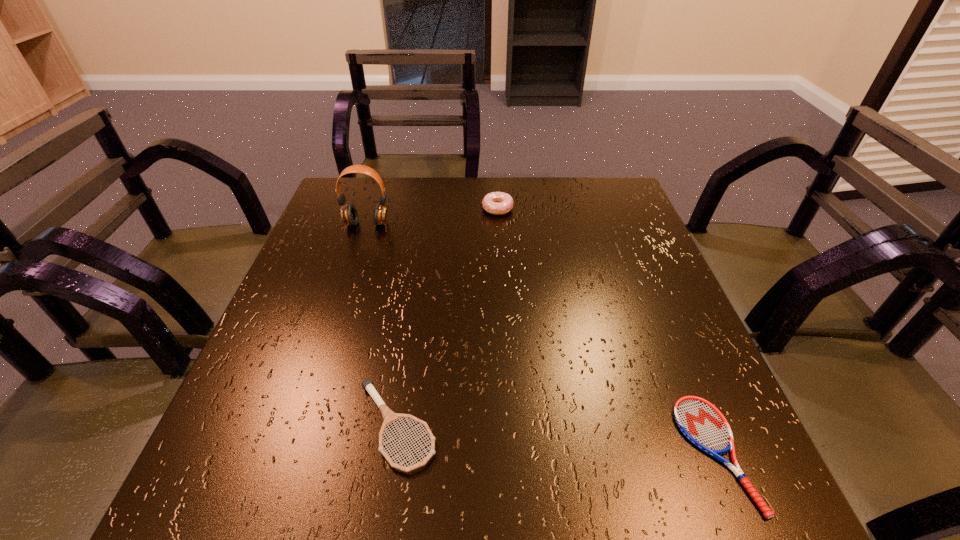
You are a GUI agent. You are given a task and a screenshot of the screen. Output one action in this format:
    pyautogui.click(x=<x>, y=<y>)
    Task: Click on the vacant area situated on the right of the left tennis racket
    The image size is (960, 540).
    Given the screenshot: What is the action you would take?
    pyautogui.click(x=566, y=426)

You are a GUI agent. You are given a task and a screenshot of the screen. Output one action in this format:
    pyautogui.click(x=<x>, y=<y>)
    Task: Click on the vacant region located on the back of the right tennis racket
    
    Given the screenshot: What is the action you would take?
    pyautogui.click(x=676, y=357)

Find the location of a particular element. This screenshot has height=540, width=960. headset located in the far edge section of the desktop is located at coordinates (349, 215).

Locate an element on the screen. The height and width of the screenshot is (540, 960). doughnut present at the far edge is located at coordinates (498, 203).

You are a GUI agent. You are given a task and a screenshot of the screen. Output one action in this format:
    pyautogui.click(x=<x>, y=<y>)
    Task: Click on the object that is at the left edge
    The height and width of the screenshot is (540, 960).
    Given the screenshot: What is the action you would take?
    pyautogui.click(x=349, y=215)

You are a GUI agent. You are given a task and a screenshot of the screen. Output one action in this format:
    pyautogui.click(x=<x>, y=<y>)
    Task: Click on the object present at the right edge
    
    Given the screenshot: What is the action you would take?
    pyautogui.click(x=700, y=421)

At what (x,y) coordinates should I click in order to perform the action: click on object at the far left corner. Please return your answer as a coordinate pair (x, y). This screenshot has width=960, height=540. Looking at the image, I should click on (349, 215).

The image size is (960, 540). I want to click on object present at the near right corner, so 700,421.

This screenshot has width=960, height=540. I want to click on vacant region at the far edge of the desktop, so click(507, 177).

The height and width of the screenshot is (540, 960). What are the coordinates of `free space at the near edge of the desktop` in the screenshot? It's located at (494, 487).